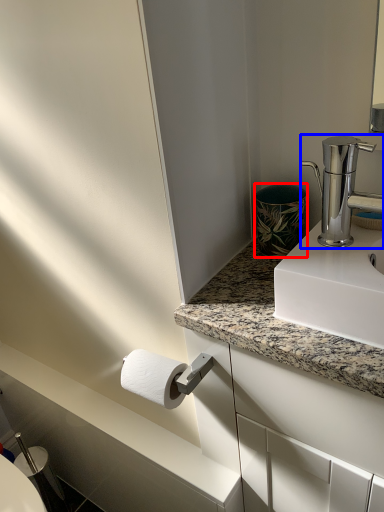
Question: Which object is further to the camera taking this photo, appliance (highlighted by a red box) or tap (highlighted by a blue box)?

Choices:
 (A) appliance
 (B) tap

Answer: (A)